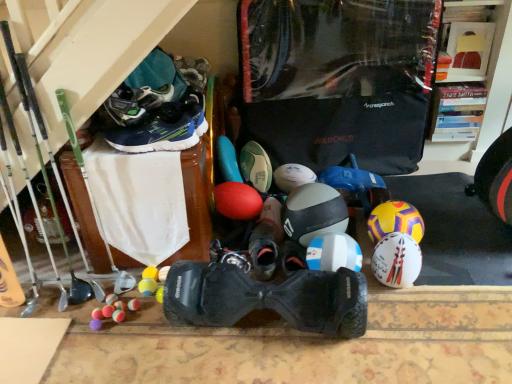
What are the coordinates of `vacant area that is situated to the right of white matte helmet at center, the 2th helmet when ordered from right to left` in the screenshot? It's located at (444, 280).